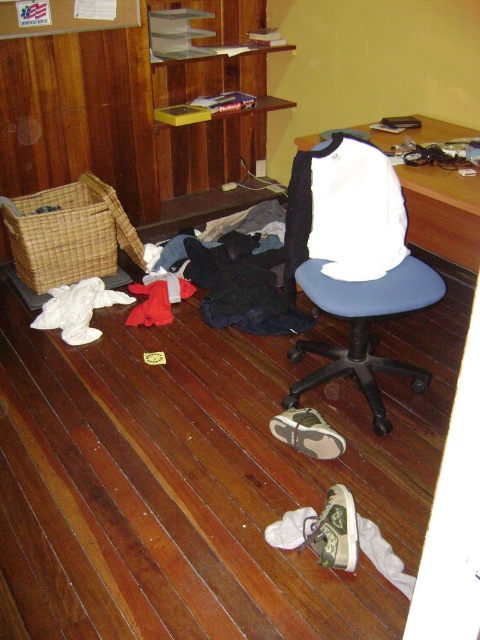
Question: Can you confirm if blue fabric swivel chair at center is positioned to the right of white canvas shoe at lower center?

Choices:
 (A) yes
 (B) no

Answer: (A)

Question: Estimate the real-world distances between objects in this image. Which object is farther from the white canvas shoe at lower center?

Choices:
 (A) blue fabric swivel chair at center
 (B) tan suede shoe at lower center
 (C) wooden desk at center

Answer: (C)

Question: Estimate the real-world distances between objects in this image. Which object is farther from the wooden desk at center?

Choices:
 (A) white canvas shoe at lower center
 (B) blue fabric swivel chair at center

Answer: (A)

Question: Does wooden desk at center have a lesser width compared to white canvas shoe at lower center?

Choices:
 (A) no
 (B) yes

Answer: (A)

Question: Which object appears closest to the camera in this image?

Choices:
 (A) wooden desk at center
 (B) blue fabric swivel chair at center
 (C) white canvas shoe at lower center

Answer: (C)

Question: Is wooden desk at center to the right of white canvas shoe at lower center from the viewer's perspective?

Choices:
 (A) no
 (B) yes

Answer: (B)